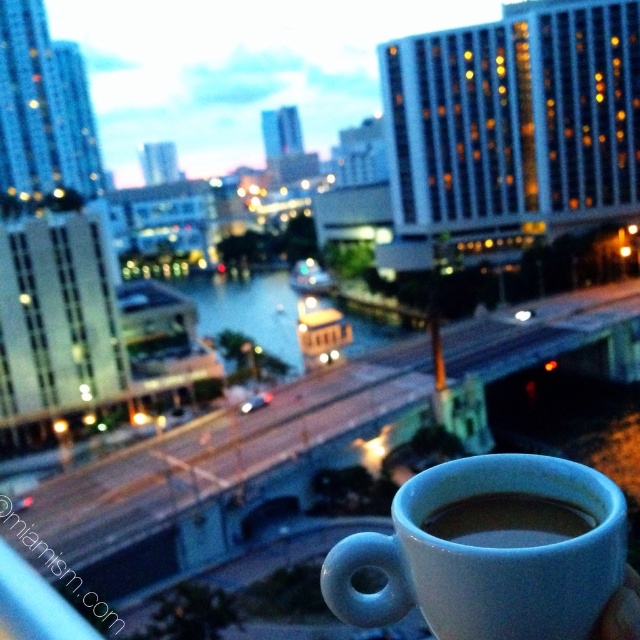
Looking at this image, who is positioned more to the left, matte ceramic mug at lower right or white matte cup at lower right?

matte ceramic mug at lower right is more to the left.

Does matte ceramic mug at lower right have a greater width compared to white matte cup at lower right?

Yes.

Is point (371, 556) farther from camera compared to point (492, 531)?

No, it is in front of (492, 531).

Identify the location of matte ceramic mug at lower right. (490, 552).